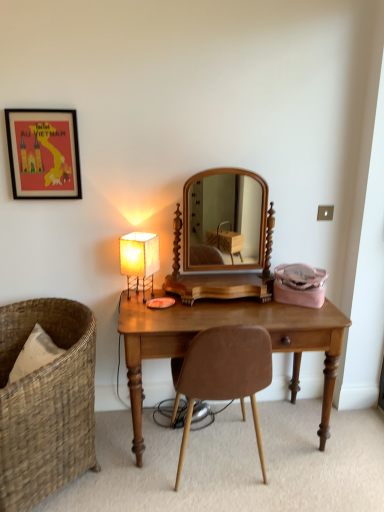
Find the location of a particular element. free spot to the right of brown leather chair at center, which ranks as the 1th chair in right-to-left order is located at coordinates (322, 477).